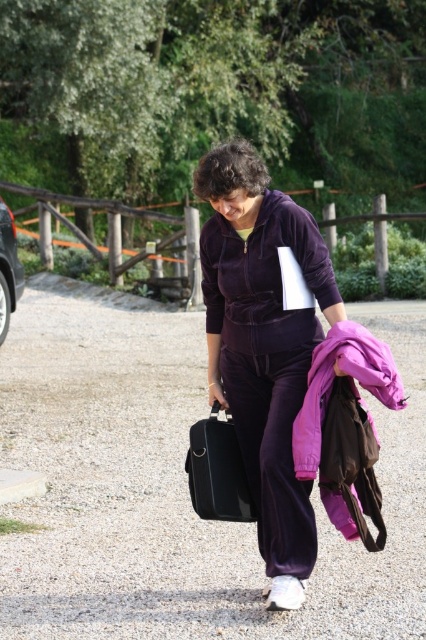
Question: Is velvet purple tracksuit at center above metallic silver car at left?

Choices:
 (A) yes
 (B) no

Answer: (B)

Question: From the image, what is the correct spatial relationship of velvet purple tracksuit at center in relation to metallic silver car at left?

Choices:
 (A) above
 (B) below

Answer: (B)

Question: Among these points, which one is nearest to the camera?

Choices:
 (A) [x=218, y=419]
 (B) [x=258, y=168]

Answer: (B)

Question: Which of the following is the farthest from the observer?

Choices:
 (A) black leather briefcase at center
 (B) metallic silver car at left
 (C) velvet purple tracksuit at center

Answer: (B)

Question: Is the position of velvet purple tracksuit at center less distant than that of black leather briefcase at center?

Choices:
 (A) no
 (B) yes

Answer: (B)

Question: Which point is closer to the camera?

Choices:
 (A) velvet purple tracksuit at center
 (B) black leather briefcase at center

Answer: (A)